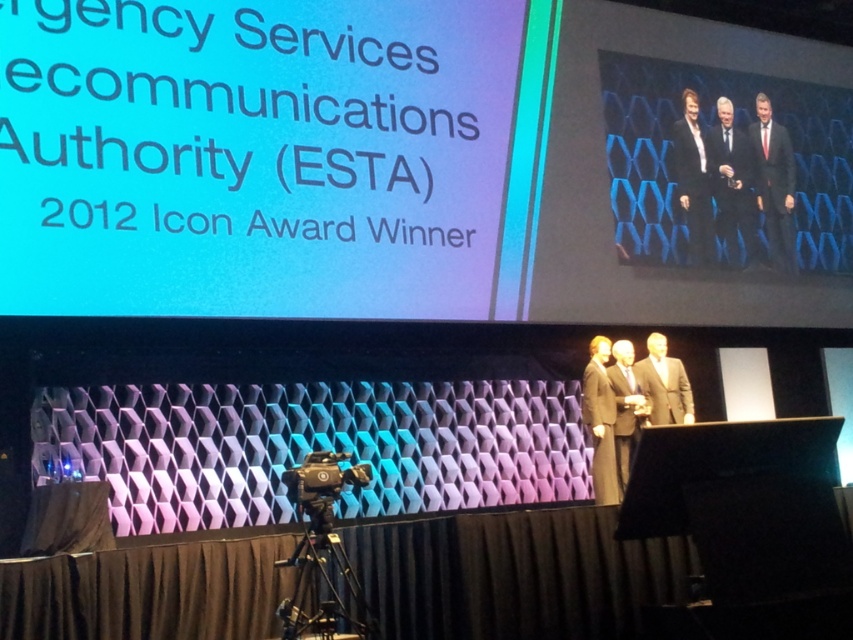
You are an event planner preparing for a similar award ceremony. You need to ensure that the text on the screen is visible to all attendees. Given that the matte black suit at right is 1.8 meters tall, can you estimate the minimum height the matte black text at upper left should be to remain legible from the back of the room?

The matte black text at upper left is bigger than the matte black suit at right, which is 1.8 meters tall. Therefore, the text should be taller than 1.8 meters to ensure legibility from the back of the room.

You are standing on the stage and want to place a small decoration between the two points, point (315, 243) and point (776, 129). Which point is closer to you so you can start placing the decoration from there?

Point (315, 243) is closer to the camera than point (776, 129), so you should start placing the decoration from point (315, 243) first.